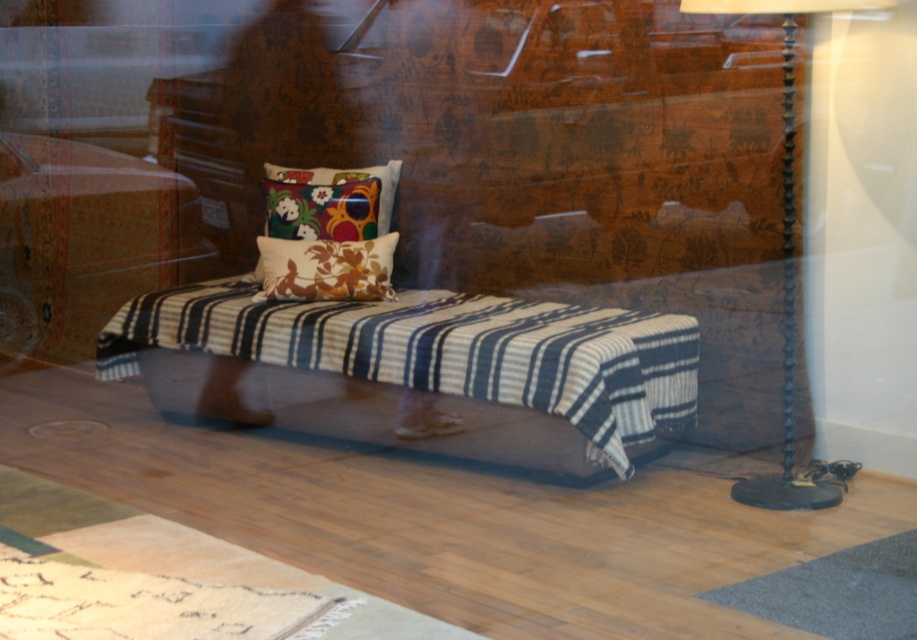
Question: Which of the following is the closest to the observer?

Choices:
 (A) striped fabric bench at center
 (B) floral fabric cushion at center
 (C) floral-patterned fabric pillow at center
 (D) black metal floor lamp at right

Answer: (D)

Question: Based on their relative distances, which object is farther from the floral fabric cushion at center?

Choices:
 (A) striped fabric bench at center
 (B) black metal floor lamp at right

Answer: (B)

Question: Does striped fabric bench at center appear over floral-patterned fabric pillow at center?

Choices:
 (A) yes
 (B) no

Answer: (B)

Question: Which point appears farthest from the camera in this image?

Choices:
 (A) click(300, 252)
 (B) click(532, 362)
 (C) click(381, 164)
 (D) click(793, 134)

Answer: (C)

Question: Considering the relative positions of striped fabric bench at center and floral fabric cushion at center in the image provided, where is striped fabric bench at center located with respect to floral fabric cushion at center?

Choices:
 (A) above
 (B) below

Answer: (B)

Question: Does floral-patterned fabric pillow at center appear on the right side of floral fabric cushion at center?

Choices:
 (A) no
 (B) yes

Answer: (B)